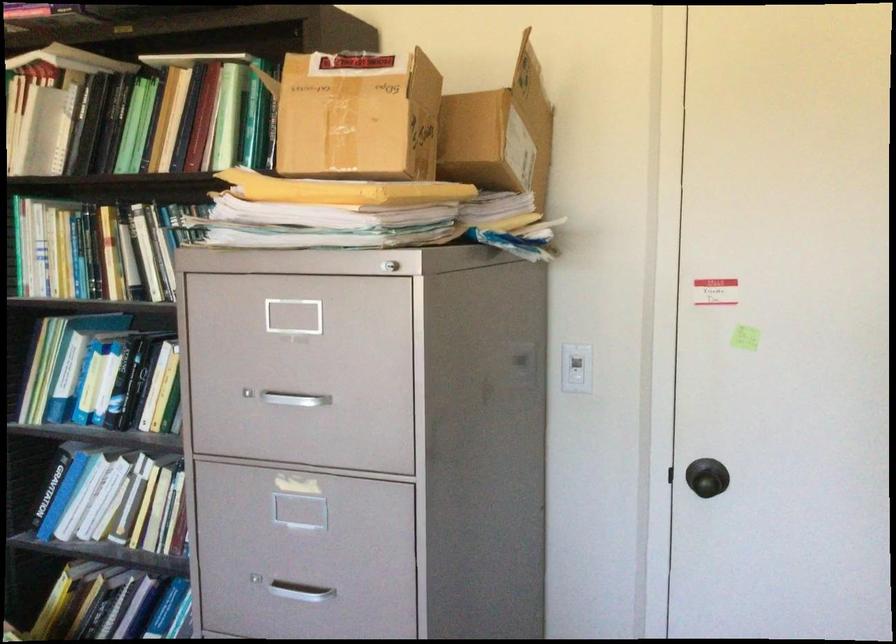
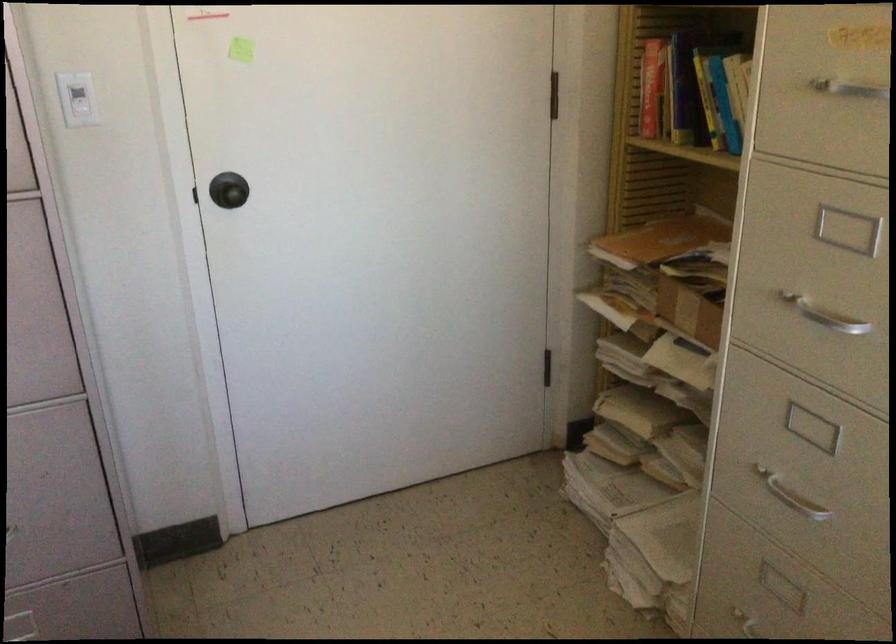
Find the pixel in the second image that matches (712,476) in the first image.

(228, 190)